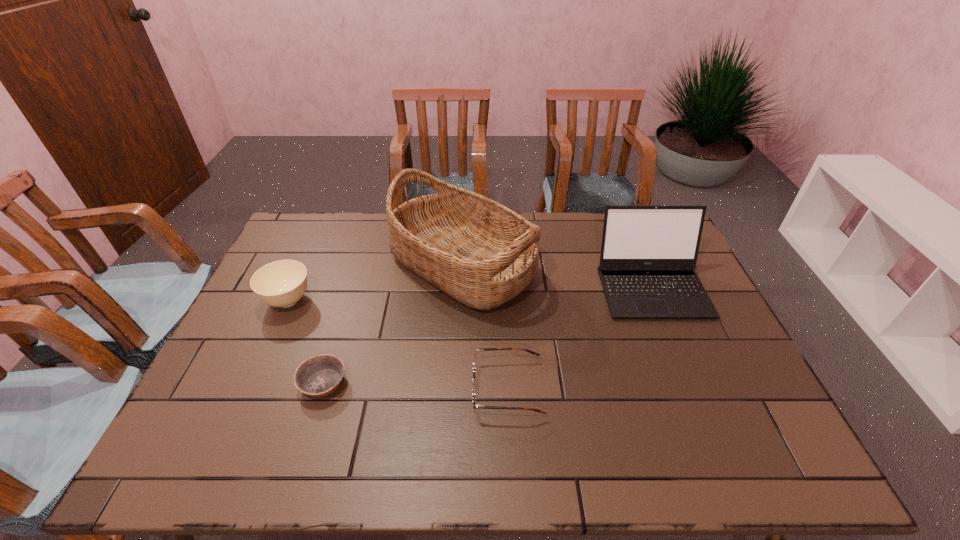
The image size is (960, 540). I want to click on free space between the laptop and the spectacles, so click(580, 338).

Identify the location of free space between the shortest object and the spectacles. (416, 386).

Locate an element on the screen. empty space between the leftmost object and the second shortest object is located at coordinates (397, 345).

In order to click on the closest object to the second shortest object in this screenshot , I will do `click(479, 252)`.

Where is `object that is the closest to the second tallest object`? The image size is (960, 540). object that is the closest to the second tallest object is located at coordinates (479, 252).